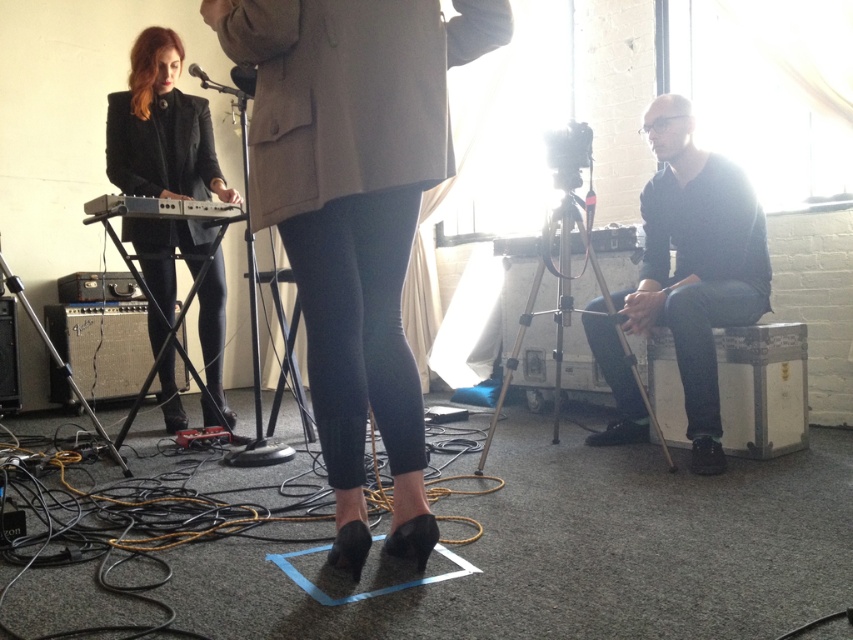
You are a stagehand in a rehearsal space. You need to place a new microphone stand at the point marked by the coordinate point (695, 262). However, there is an object at that location. What is the object at that point?

The object at the coordinate point (695, 262) is the dark gray sweater at right.

You are a stagehand setting up a performance space. You need to place a 2 meter long extension cord between the dark gray sweater at right and the matte black jacket at left. Will the cord be long enough to reach both objects without bending it?

The dark gray sweater at right and matte black jacket at left are 1.95 meters apart. The 2 meter long extension cord is slightly longer than the distance between them, so it will be long enough to reach both objects without bending it.

You are standing in the rehearsal space and see two points marked on the floor. One is at coordinate point (701, 429) and the other is at point (195, 76). Which point is closer to you?

Point (701, 429) is closer to the viewer than point (195, 76).